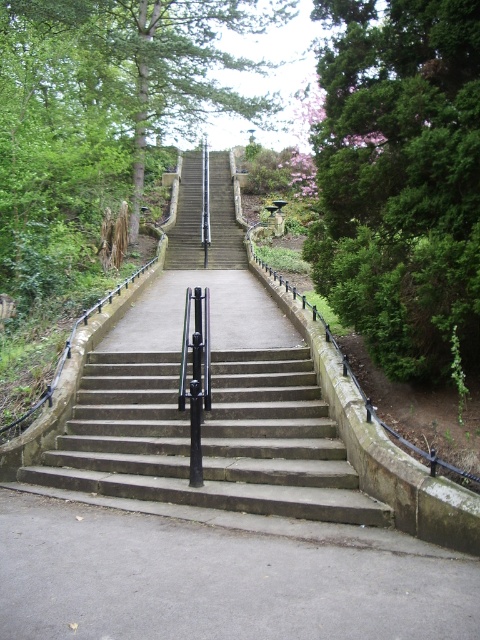
Which is more to the right, green leafy tree at right or green leafy tree at upper left?

green leafy tree at right

Is green leafy tree at right taller than green leafy tree at upper left?

In fact, green leafy tree at right may be shorter than green leafy tree at upper left.

The height and width of the screenshot is (640, 480). What are the coordinates of `green leafy tree at right` in the screenshot? It's located at (400, 179).

Is green leafy tree at upper left taller than concrete stairs at center?

Yes.

Is point (128, 157) positioned after point (126, 497)?

Yes, point (128, 157) is behind point (126, 497).

Find the location of a particular element. Image resolution: width=480 pixels, height=640 pixels. green leafy tree at upper left is located at coordinates (108, 92).

Does green leafy tree at right have a lesser width compared to concrete stairs at center?

Yes.

Who is more forward, (396, 326) or (129, 380)?

Point (396, 326) is in front.

Where is `green leafy tree at right`? The image size is (480, 640). green leafy tree at right is located at coordinates (400, 179).